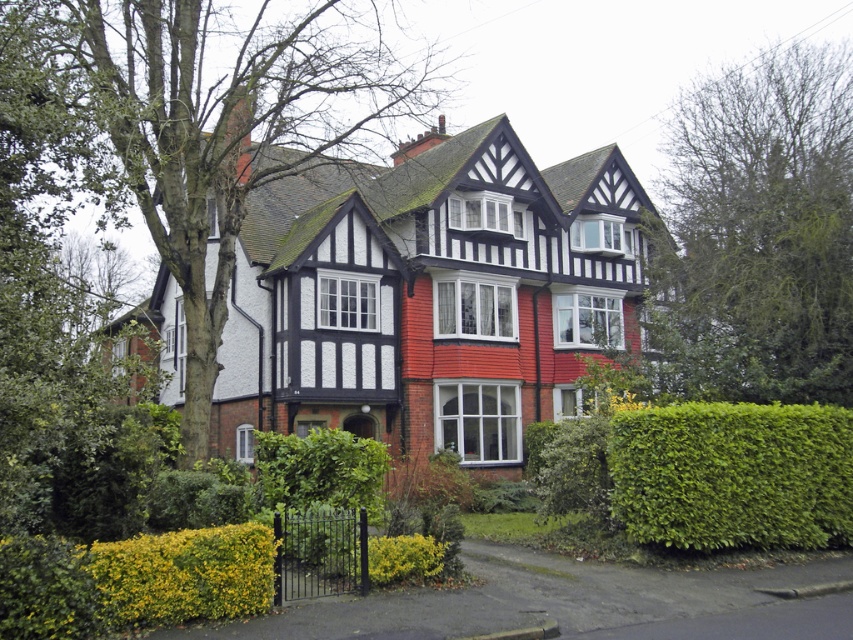
Question: Which point is closer to the camera?

Choices:
 (A) (292, 444)
 (B) (49, 154)
 (C) (618, 499)

Answer: (B)

Question: Is green leafy hedge at lower right closer to camera compared to green leafy hedge at center?

Choices:
 (A) yes
 (B) no

Answer: (B)

Question: Which of the following is the closest to the observer?

Choices:
 (A) green leafy tree at upper right
 (B) green leafy hedge at lower right
 (C) green leafy hedge at center

Answer: (C)

Question: Is green leafy hedge at lower right positioned in front of green leafy hedge at center?

Choices:
 (A) no
 (B) yes

Answer: (A)

Question: Which of the following is the closest to the observer?

Choices:
 (A) (312, 451)
 (B) (651, 538)
 (C) (4, 72)
 (D) (770, 296)

Answer: (C)

Question: Can you confirm if green leafy hedge at lower right is wider than green leafy hedge at center?

Choices:
 (A) no
 (B) yes

Answer: (B)